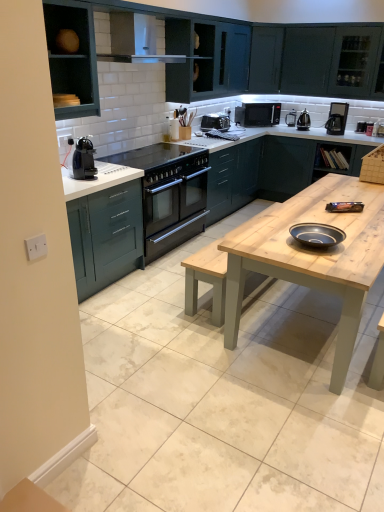
In order to click on satin black toaster at upper center, the 1th appliance positioned from the left in this screenshot , I will do `click(215, 122)`.

Measure the distance between wooden countertop at right, which appears as the first cabinetry when viewed from the back, and camera.

A distance of 5.08 meters exists between wooden countertop at right, which appears as the first cabinetry when viewed from the back, and camera.

Where is `wooden countertop at right, acting as the third cabinetry starting from the left`? The image size is (384, 512). wooden countertop at right, acting as the third cabinetry starting from the left is located at coordinates (284, 167).

This screenshot has height=512, width=384. Describe the element at coordinates (206, 59) in the screenshot. I see `matte teal cabinet at upper center, the second cabinetry when ordered from left to right` at that location.

What do you see at coordinates (136, 40) in the screenshot?
I see `white glossy exhaust hood at upper center` at bounding box center [136, 40].

Locate an element on the screen. This screenshot has width=384, height=512. satin black coffee machine at upper right is located at coordinates (337, 118).

Looking at this image, is black plastic coffee machine at left not inside metallic silver toaster at upper right, the fourth appliance from the left?

Indeed, black plastic coffee machine at left is completely outside metallic silver toaster at upper right, the fourth appliance from the left.

Is point (89, 165) positioned before point (357, 122)?

Yes, it is.

In the scene shown: Considering the positions of objects black plastic coffee machine at left and metallic silver toaster at upper right, the first appliance when ordered from right to left, in the image provided, who is more to the right, black plastic coffee machine at left or metallic silver toaster at upper right, the first appliance when ordered from right to left,?

metallic silver toaster at upper right, the first appliance when ordered from right to left, is more to the right.

Is black plastic coffee machine at left far from metallic silver toaster at upper right, the fourth appliance from the left?

Yes, black plastic coffee machine at left and metallic silver toaster at upper right, the fourth appliance from the left, are located far from each other.

From a real-world perspective, is teal matte cabinet at upper left, placed as the 1th cabinetry when sorted from left to right, physically below black matte microwave at upper right?

No, from a real-world perspective, teal matte cabinet at upper left, placed as the 1th cabinetry when sorted from left to right, is not below black matte microwave at upper right.

Does teal matte cabinet at upper left, the 4th cabinetry viewed from the right, contain black matte microwave at upper right?

No, black matte microwave at upper right is located outside of teal matte cabinet at upper left, the 4th cabinetry viewed from the right.

From the image's perspective, is teal matte cabinet at upper left, placed as the 1th cabinetry when sorted from left to right, located beneath black matte microwave at upper right?

Indeed, from the image's perspective, teal matte cabinet at upper left, placed as the 1th cabinetry when sorted from left to right, is shown beneath black matte microwave at upper right.

Is teal matte cabinet at upper left, placed as the 1th cabinetry when sorted from left to right, next to black matte microwave at upper right and touching it?

There is a gap between teal matte cabinet at upper left, placed as the 1th cabinetry when sorted from left to right, and black matte microwave at upper right.

In the scene shown: Considering the relative sizes of satin black coffee machine at upper right and matte blue bowl at center in the image provided, is satin black coffee machine at upper right bigger than matte blue bowl at center?

Correct, satin black coffee machine at upper right is larger in size than matte blue bowl at center.

Looking at this image, which object is positioned more to the left, satin black coffee machine at upper right or matte blue bowl at center?

matte blue bowl at center is more to the left.

Are satin black coffee machine at upper right and matte blue bowl at center far apart?

Yes, satin black coffee machine at upper right is far from matte blue bowl at center.

Locate an element on the screen. This screenshot has height=512, width=384. appliance that is the 2nd object to the left of the polished stainless steel kettle at upper right, which appears as the 3th appliance when viewed from the left, starting at the anchor is located at coordinates (215, 122).

Is polished stainless steel kettle at upper right, arranged as the second appliance when viewed from the right, completely or partially outside of satin black toaster at upper center, which is counted as the 4th appliance, starting from the right?

polished stainless steel kettle at upper right, arranged as the second appliance when viewed from the right, is positioned outside satin black toaster at upper center, which is counted as the 4th appliance, starting from the right.

Looking at this image, is polished stainless steel kettle at upper right, arranged as the second appliance when viewed from the right, not close to satin black toaster at upper center, which is counted as the 4th appliance, starting from the right?

polished stainless steel kettle at upper right, arranged as the second appliance when viewed from the right, is far away from satin black toaster at upper center, which is counted as the 4th appliance, starting from the right.

Which object is closer to the camera, black matte microwave at upper right or matte blue bowl at center?

Positioned in front is matte blue bowl at center.

Looking at their sizes, would you say black matte microwave at upper right is wider or thinner than matte blue bowl at center?

In the image, black matte microwave at upper right appears to be wider than matte blue bowl at center.

From the image's perspective, between black matte microwave at upper right and matte blue bowl at center, who is located below?

From the image's view, matte blue bowl at center is below.

From a real-world perspective, is matte blue bowl at center above or below polished stainless steel kettle at upper right, arranged as the second appliance when viewed from the right?

matte blue bowl at center is situated lower than polished stainless steel kettle at upper right, arranged as the second appliance when viewed from the right, in the real world.

Considering the positions of point (297, 238) and point (303, 124), is point (297, 238) closer or farther from the camera than point (303, 124)?

Point (297, 238) appears to be closer to the viewer than point (303, 124).

Is the depth of matte blue bowl at center less than that of polished stainless steel kettle at upper right, arranged as the second appliance when viewed from the right?

Yes, matte blue bowl at center is in front of polished stainless steel kettle at upper right, arranged as the second appliance when viewed from the right.

From the image's perspective, is matte blue bowl at center located above or below polished stainless steel kettle at upper right, which appears as the 3th appliance when viewed from the left?

matte blue bowl at center is situated lower than polished stainless steel kettle at upper right, which appears as the 3th appliance when viewed from the left, in the image.

Considering their positions, is white glossy exhaust hood at upper center located in front of or behind metallic silver kettle at upper right, the second appliance positioned from the left?

Clearly, white glossy exhaust hood at upper center is in front of metallic silver kettle at upper right, the second appliance positioned from the left.

Measure the distance from white glossy exhaust hood at upper center to metallic silver kettle at upper right, which appears as the third appliance when viewed from the right.

white glossy exhaust hood at upper center and metallic silver kettle at upper right, which appears as the third appliance when viewed from the right, are 2.51 meters apart.

Is point (118, 42) positioned before point (290, 124)?

Yes, it is in front of point (290, 124).

Is white glossy exhaust hood at upper center inside the boundaries of metallic silver kettle at upper right, which appears as the third appliance when viewed from the right, or outside?

white glossy exhaust hood at upper center is not enclosed by metallic silver kettle at upper right, which appears as the third appliance when viewed from the right.

Locate an element on the screen. The width and height of the screenshot is (384, 512). kitchen appliance that is below the metallic silver toaster at upper right, the first appliance when ordered from right to left (from the image's perspective) is located at coordinates (84, 159).

Locate an element on the screen. Image resolution: width=384 pixels, height=512 pixels. the 1st cabinetry above the black matte microwave at upper right (from a real-world perspective) is located at coordinates (73, 57).

Consider the image. Estimate the real-world distances between objects in this image. Which object is closer to black plastic coffee machine at left, white glossy exhaust hood at upper center or wooden countertop at right, which appears as the first cabinetry when viewed from the back?

The object closer to black plastic coffee machine at left is white glossy exhaust hood at upper center.

In the scene shown: Which object lies further to the anchor point black matte microwave at upper right, matte teal cabinet at upper center, the 2th cabinetry viewed from the front, or teal matte cabinet at upper left, the 4th cabinetry viewed from the right?

teal matte cabinet at upper left, the 4th cabinetry viewed from the right, is positioned further to the anchor black matte microwave at upper right.

From the image, which object appears to be farther from teal matte cabinet at upper left, the 4th cabinetry viewed from the right, light wood table at center or white glossy exhaust hood at upper center?

Among the two, light wood table at center is located further to teal matte cabinet at upper left, the 4th cabinetry viewed from the right.

From the image, which object appears to be nearer to metallic silver kettle at upper right, the second appliance positioned from the left, teal matte cabinet at upper left, arranged as the 4th cabinetry when viewed from the back, or black plastic coffee machine at left?

Among the two, teal matte cabinet at upper left, arranged as the 4th cabinetry when viewed from the back, is located nearer to metallic silver kettle at upper right, the second appliance positioned from the left.

Which object lies nearer to the anchor point satin black coffee machine at upper right, light wood table at center or black plastic coffee machine at left?

light wood table at center is positioned closer to the anchor satin black coffee machine at upper right.

Which object lies nearer to the anchor point satin black coffee machine at upper right, polished stainless steel kettle at upper right, which appears as the 3th appliance when viewed from the left, or metallic silver toaster at upper right, the first appliance when ordered from right to left?

metallic silver toaster at upper right, the first appliance when ordered from right to left, is positioned closer to the anchor satin black coffee machine at upper right.

Consider the image. Which object lies nearer to the anchor point black matte microwave at upper right, satin black toaster at upper center, which is counted as the 4th appliance, starting from the right, or white glossy exhaust hood at upper center?

satin black toaster at upper center, which is counted as the 4th appliance, starting from the right, is closer to black matte microwave at upper right.

Which object lies further to the anchor point matte teal cabinet at upper center, the third cabinetry positioned from the back, metallic silver kettle at upper right, the second appliance positioned from the left, or black plastic coffee machine at left?

Based on the image, black plastic coffee machine at left appears to be further to matte teal cabinet at upper center, the third cabinetry positioned from the back.

Identify the location of coffee machine between black matte microwave at upper right and wooden bookshelf at upper right, which ranks as the 3th cabinetry in front-to-back order, in the horizontal direction. (337, 118).

Locate an element on the screen. kitchen appliance between teal matte cabinet at upper left, arranged as the 1th cabinetry when viewed from the front, and metallic silver toaster at upper right, the fourth appliance from the left, from left to right is located at coordinates (84, 159).

Where is `coffee machine located between metallic silver kettle at upper right, which appears as the third appliance when viewed from the right, and metallic silver toaster at upper right, the fourth appliance from the left, in the left-right direction`? Image resolution: width=384 pixels, height=512 pixels. coffee machine located between metallic silver kettle at upper right, which appears as the third appliance when viewed from the right, and metallic silver toaster at upper right, the fourth appliance from the left, in the left-right direction is located at coordinates (337, 118).

Identify the location of exhaust hood between black plastic coffee machine at left and wooden bookshelf at upper right, which is counted as the first cabinetry, starting from the right. (136, 40).